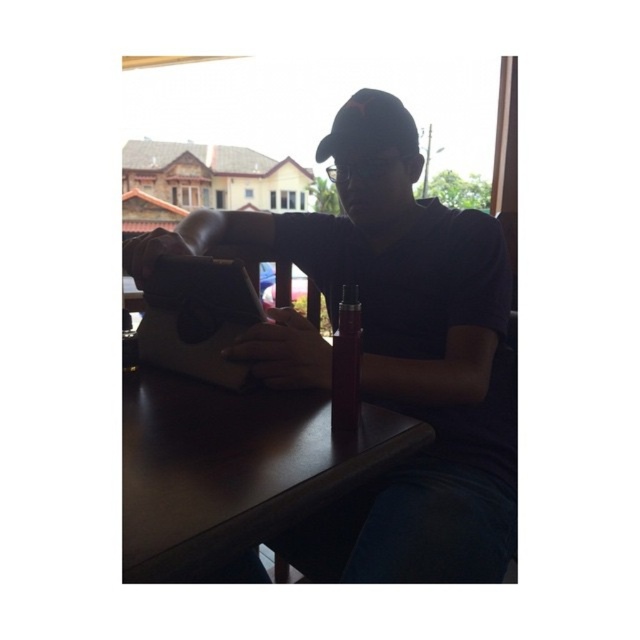
Which of these two, matte black laptop at center or dark wood table at center, stands shorter?

With less height is dark wood table at center.

Can you confirm if matte black laptop at center is positioned above dark wood table at center?

Yes, matte black laptop at center is above dark wood table at center.

Who is more distant from viewer, (444,252) or (170,454)?

Positioned behind is point (444,252).

Locate an element on the screen. The width and height of the screenshot is (640, 640). matte black laptop at center is located at coordinates (397, 353).